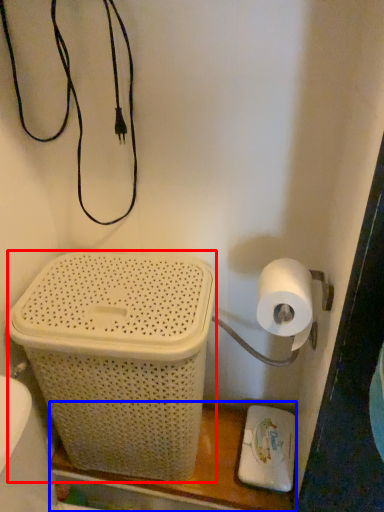
Question: Which of the following is the closest to the observer, basket container (highlighted by a red box) or shelf (highlighted by a blue box)?

Choices:
 (A) basket container
 (B) shelf

Answer: (A)